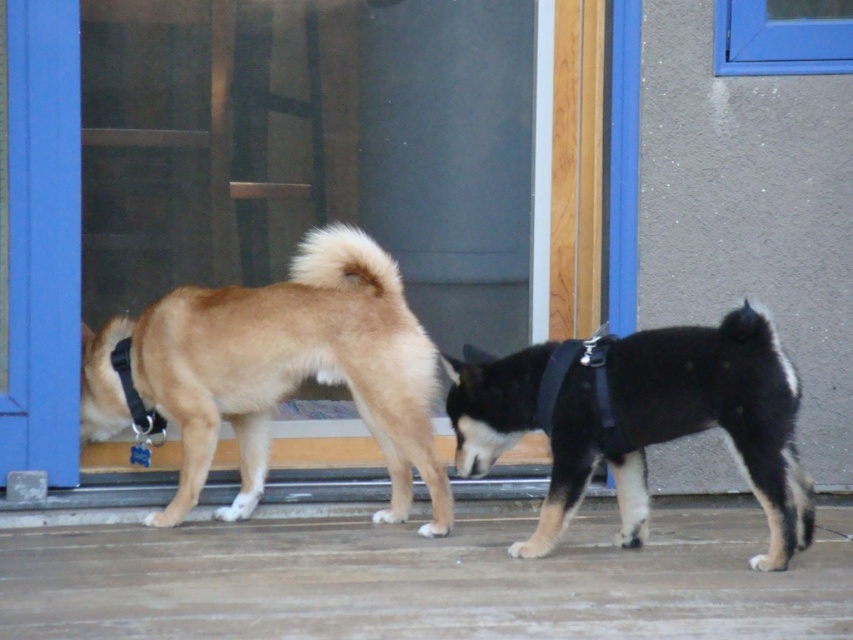
You are a photographer trying to capture both dogs in a single shot. Given that the light brown fur at left is represented by point (x=277, y=371), where should you position your camera to ensure both dogs are fully visible?

To ensure both dogs are fully visible in the shot, position the camera such that it captures the area around the light brown fur at left represented by point (x=277, y=371) and extends to include the other dog on the right.